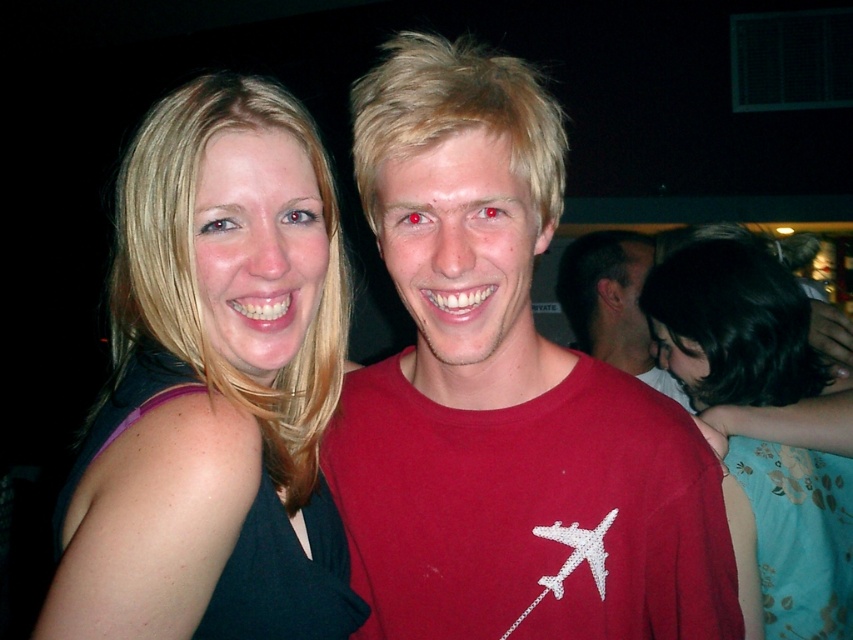
Question: Does matte black dress at left have a smaller size compared to matte red t-shirt at center?

Choices:
 (A) yes
 (B) no

Answer: (A)

Question: Which is nearer to the matte black dress at left?

Choices:
 (A) floral fabric dress at right
 (B) matte red t-shirt at center

Answer: (A)

Question: Among these points, which one is nearest to the camera?

Choices:
 (A) (303, 632)
 (B) (782, 492)
 (C) (734, 586)

Answer: (A)

Question: Does floral fabric dress at right appear under matte red t-shirt at center?

Choices:
 (A) yes
 (B) no

Answer: (A)

Question: Among these objects, which one is nearest to the camera?

Choices:
 (A) floral fabric dress at right
 (B) red matte shirt at center
 (C) matte black dress at left
 (D) matte red t-shirt at center

Answer: (C)

Question: Can you confirm if floral fabric dress at right is bigger than matte red t-shirt at center?

Choices:
 (A) yes
 (B) no

Answer: (B)